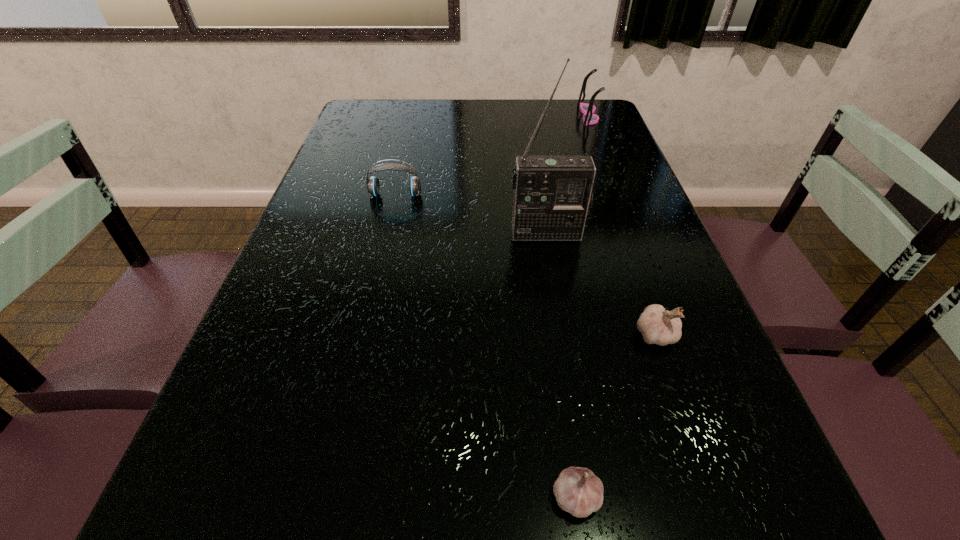
The image size is (960, 540). In order to click on free space that satisfies the following two spatial constraints: 1. on the ear cups of the shorter garlic; 2. on the right side of the leftmost object in this screenshot , I will do `click(324, 498)`.

Find the location of a particular element. The height and width of the screenshot is (540, 960). free location that satisfies the following two spatial constraints: 1. on the back side of the nearest object; 2. on the left side of the right garlic is located at coordinates (553, 334).

The width and height of the screenshot is (960, 540). Find the location of `vacant space that satisfies the following two spatial constraints: 1. on the ear cups of the farther garlic; 2. on the right side of the second farthest object`. vacant space that satisfies the following two spatial constraints: 1. on the ear cups of the farther garlic; 2. on the right side of the second farthest object is located at coordinates (363, 334).